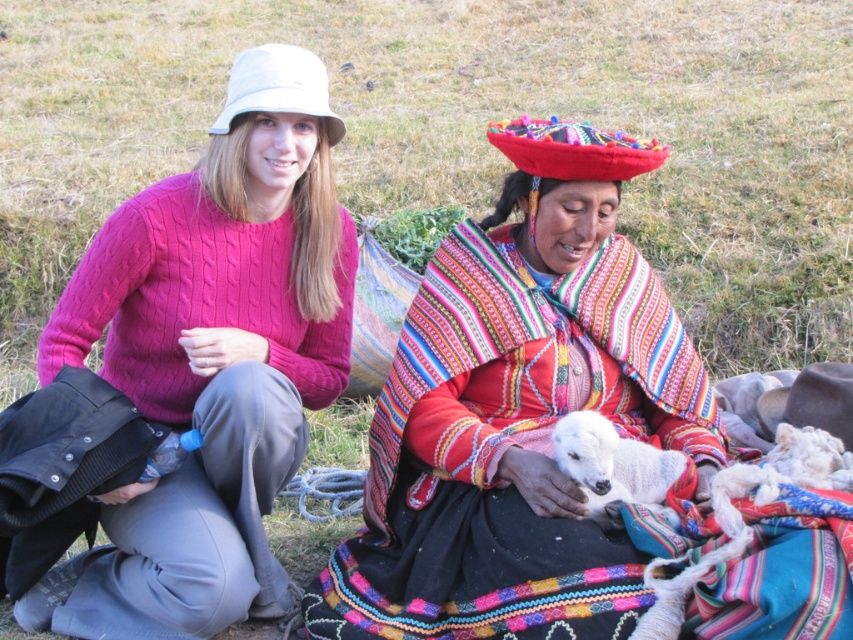
You are taking a photo of two people sitting on a grassy field. You notice two points in the image labeled as point 1 at coordinates (x=520, y=600) and point 2 at (x=650, y=492). Which point is closer to the camera?

Point 1 at coordinates (x=520, y=600) is closer to the camera than point 2 at (x=650, y=492).